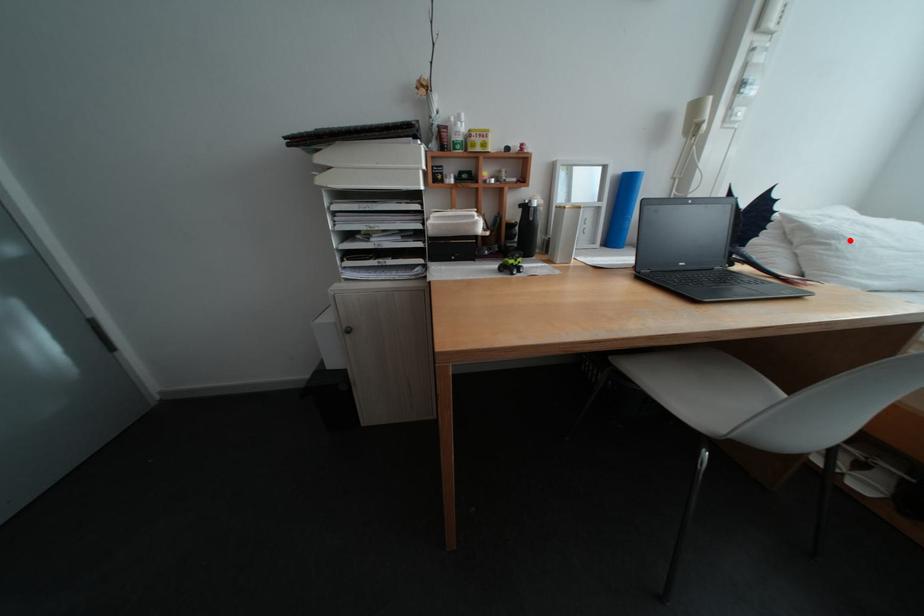
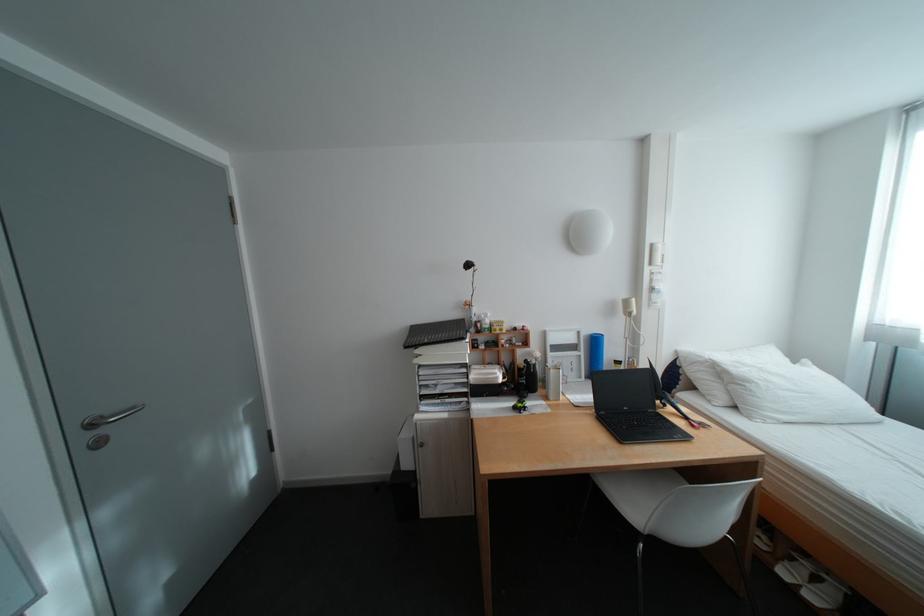
The point at the highlighted location is marked in the first image. Where is the corresponding point in the second image?

(761, 384)